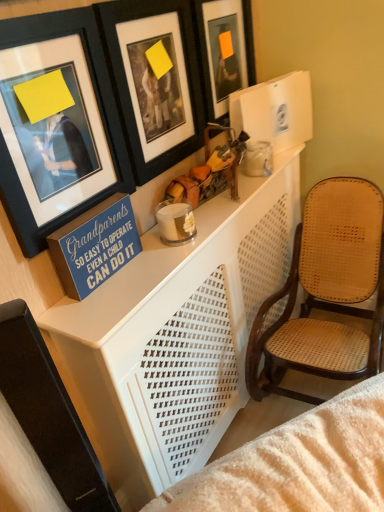
Question: Is blue painted wood sign at upper left taller than black matte picture frame at upper center, the 2th picture frame when ordered from right to left?

Choices:
 (A) no
 (B) yes

Answer: (A)

Question: From the image's perspective, would you say blue painted wood sign at upper left is shown under black matte picture frame at upper center, the 2th picture frame when ordered from right to left?

Choices:
 (A) no
 (B) yes

Answer: (B)

Question: Is blue painted wood sign at upper left bigger than black matte picture frame at upper center, the 2th picture frame when ordered from right to left?

Choices:
 (A) yes
 (B) no

Answer: (B)

Question: Can you see blue painted wood sign at upper left touching black matte picture frame at upper center, the second picture frame in the left-to-right sequence?

Choices:
 (A) no
 (B) yes

Answer: (A)

Question: From a real-world perspective, is blue painted wood sign at upper left located higher than black matte picture frame at upper center, the 2th picture frame when ordered from right to left?

Choices:
 (A) no
 (B) yes

Answer: (A)

Question: Is orange matte picture frame at upper center, acting as the 1th picture frame starting from the right, inside or outside of black matte picture frame at upper center, the second picture frame in the left-to-right sequence?

Choices:
 (A) outside
 (B) inside

Answer: (A)

Question: From the image's perspective, relative to black matte picture frame at upper center, the 2th picture frame when ordered from right to left, is orange matte picture frame at upper center, the 3th picture frame in the left-to-right sequence, above or below?

Choices:
 (A) above
 (B) below

Answer: (A)

Question: Considering the positions of orange matte picture frame at upper center, acting as the 1th picture frame starting from the right, and black matte picture frame at upper center, the 2th picture frame when ordered from right to left, in the image, is orange matte picture frame at upper center, acting as the 1th picture frame starting from the right, wider or thinner than black matte picture frame at upper center, the 2th picture frame when ordered from right to left,?

Choices:
 (A) thin
 (B) wide

Answer: (A)

Question: Is point (203, 82) closer or farther from the camera than point (122, 95)?

Choices:
 (A) closer
 (B) farther

Answer: (B)

Question: From the image's perspective, is black matte picture frame at upper center, the second picture frame in the left-to-right sequence, located above or below orange matte picture frame at upper center, acting as the 1th picture frame starting from the right?

Choices:
 (A) below
 (B) above

Answer: (A)

Question: In terms of size, does black matte picture frame at upper center, the 2th picture frame when ordered from right to left, appear bigger or smaller than orange matte picture frame at upper center, acting as the 1th picture frame starting from the right?

Choices:
 (A) small
 (B) big

Answer: (B)

Question: Is black matte picture frame at upper center, the 2th picture frame when ordered from right to left, inside or outside of orange matte picture frame at upper center, the 3th picture frame in the left-to-right sequence?

Choices:
 (A) outside
 (B) inside

Answer: (A)

Question: In terms of height, does black matte picture frame at upper center, the 2th picture frame when ordered from right to left, look taller or shorter compared to orange matte picture frame at upper center, the 3th picture frame in the left-to-right sequence?

Choices:
 (A) short
 (B) tall

Answer: (B)

Question: From a real-world perspective, is black matte picture frame at upper center, the second picture frame in the left-to-right sequence, physically located above or below blue painted wood sign at upper left?

Choices:
 (A) below
 (B) above

Answer: (B)

Question: From the image's perspective, is black matte picture frame at upper center, the second picture frame in the left-to-right sequence, above or below blue painted wood sign at upper left?

Choices:
 (A) above
 (B) below

Answer: (A)